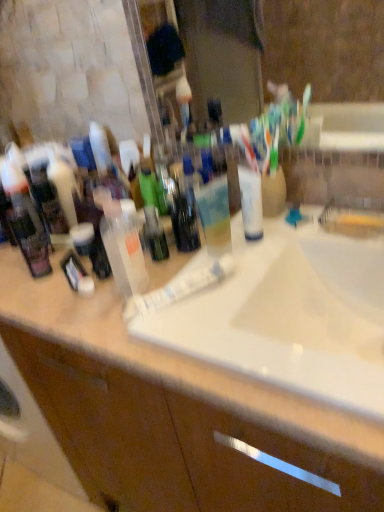
Locate an element on the screen. The image size is (384, 512). vacant area that lies in front of translucent plastic tube at left, the fourth toiletry positioned from the right is located at coordinates (54, 304).